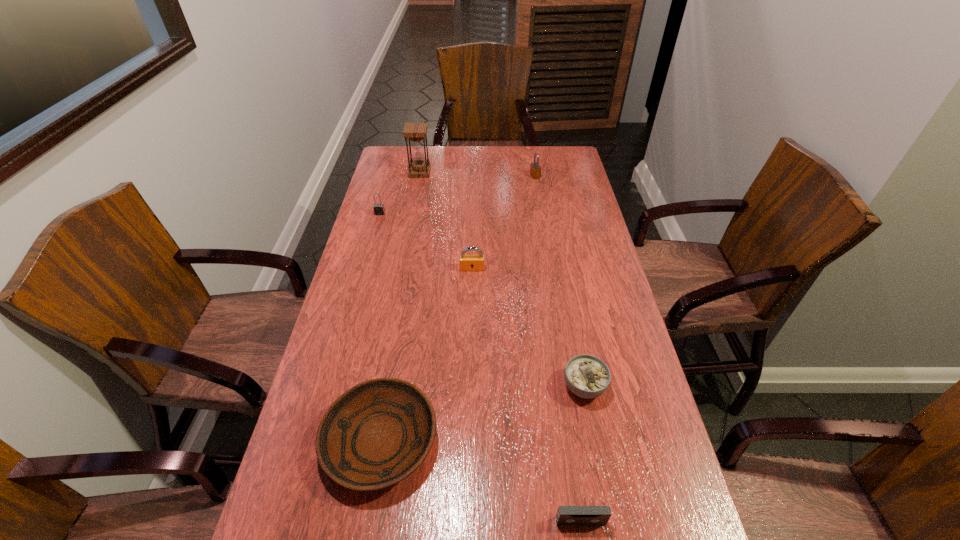
Where is `free spot between the hourglass and the plate`? This screenshot has width=960, height=540. free spot between the hourglass and the plate is located at coordinates (400, 307).

Where is `object identified as the closest to the videotape`? Image resolution: width=960 pixels, height=540 pixels. object identified as the closest to the videotape is located at coordinates (587, 376).

Point out which object is positioned as the fourth nearest to the soup bowl. Please provide its 2D coordinates. Your answer should be formatted as a tuple, i.e. [(x, y)], where the tuple contains the x and y coordinates of a point satisfying the conditions above.

[(379, 209)]

Identify which padlock is located as the nearest to the plate. Please provide its 2D coordinates. Your answer should be formatted as a tuple, i.e. [(x, y)], where the tuple contains the x and y coordinates of a point satisfying the conditions above.

[(466, 262)]

This screenshot has height=540, width=960. I want to click on the third closest padlock to the soup bowl, so click(535, 170).